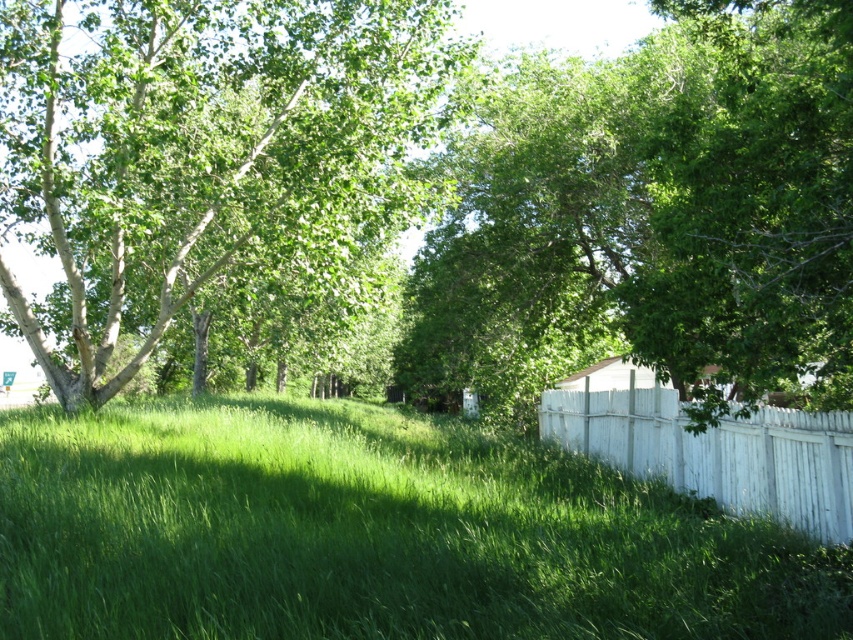
Is green leafy tree at left to the left of white wooden fence at right from the viewer's perspective?

Yes, green leafy tree at left is to the left of white wooden fence at right.

From the picture: Is green leafy tree at left positioned before white wooden fence at right?

No.

You are a GUI agent. You are given a task and a screenshot of the screen. Output one action in this format:
    pyautogui.click(x=<x>, y=<y>)
    Task: Click on the green leafy tree at left
    Image resolution: width=853 pixels, height=640 pixels.
    Given the screenshot: What is the action you would take?
    pyautogui.click(x=199, y=152)

Does green grassy at right lie behind green leafy tree at left?

No, it is not.

Does point (689, 522) come closer to viewer compared to point (140, 152)?

Yes, point (689, 522) is in front of point (140, 152).

Identify the location of green grassy at right. (370, 532).

Is point (457, 419) less distant than point (758, 160)?

No, (457, 419) is behind (758, 160).

Based on the photo, can you confirm if green grassy at right is wider than green leafy tree at center?

Correct, the width of green grassy at right exceeds that of green leafy tree at center.

Between point (51, 484) and point (543, 317), which one is positioned behind?

The point (543, 317) is more distant.

You are a GUI agent. You are given a task and a screenshot of the screen. Output one action in this format:
    pyautogui.click(x=<x>, y=<y>)
    Task: Click on the green grassy at right
    
    Given the screenshot: What is the action you would take?
    pyautogui.click(x=370, y=532)